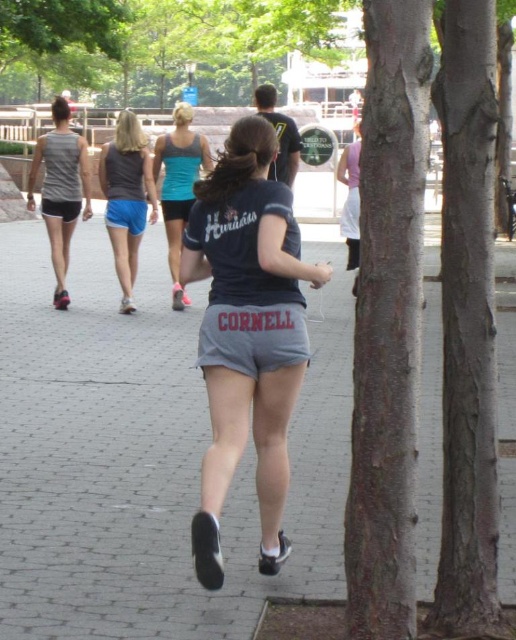
What do you see at coordinates (247, 333) in the screenshot? The width and height of the screenshot is (516, 640). I see `gray matte shorts at center` at bounding box center [247, 333].

Can you confirm if gray matte shorts at center is shorter than teal fabric tank top at center?

Indeed, gray matte shorts at center has a lesser height compared to teal fabric tank top at center.

Between point (240, 378) and point (181, 307), which one is positioned in front?

Positioned in front is point (240, 378).

This screenshot has height=640, width=516. I want to click on gray matte shorts at center, so click(247, 333).

Does gray matte shorts at center come in front of matte gray tank top at left?

Yes, gray matte shorts at center is in front of matte gray tank top at left.

Image resolution: width=516 pixels, height=640 pixels. What do you see at coordinates (247, 333) in the screenshot?
I see `gray matte shorts at center` at bounding box center [247, 333].

Identify the location of gray matte shorts at center. The image size is (516, 640). (247, 333).

In order to click on gray matte shorts at center in this screenshot , I will do `click(247, 333)`.

Is gray concrete pavement at center below matte gray tank top at left?

Yes.

Between point (24, 400) and point (40, 154), which one is positioned in front?

Positioned in front is point (24, 400).

Image resolution: width=516 pixels, height=640 pixels. Identify the location of gray concrete pavement at center. (146, 452).